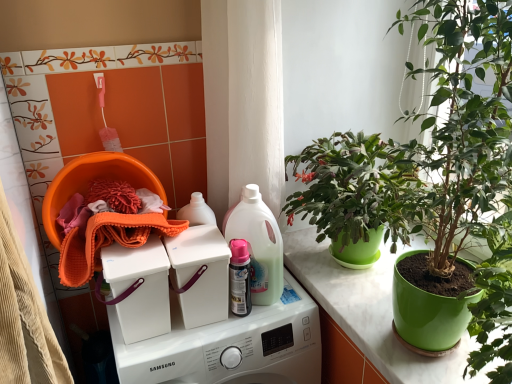
Identify the location of free spot in front of translucent plastic spray bottle at center. Image resolution: width=512 pixels, height=384 pixels. (247, 323).